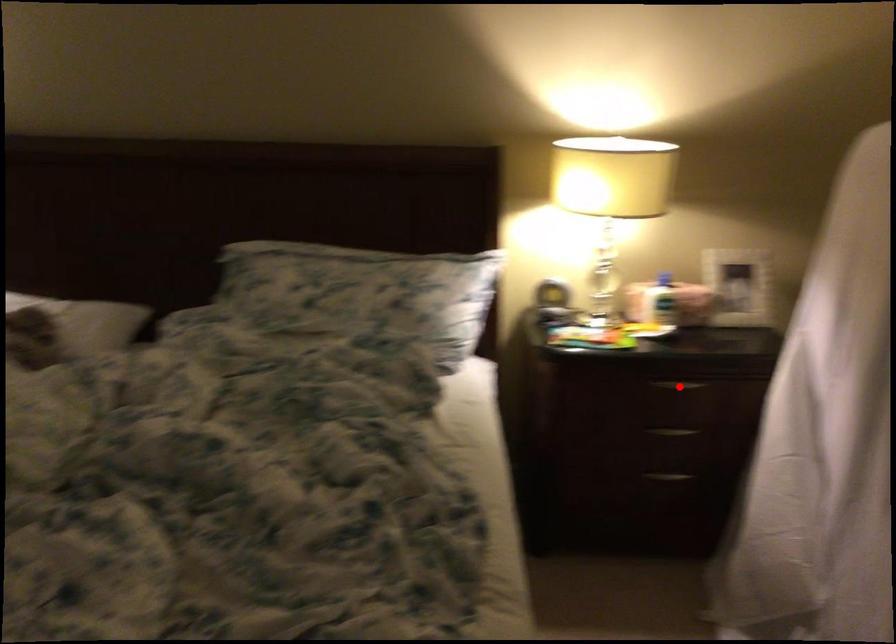
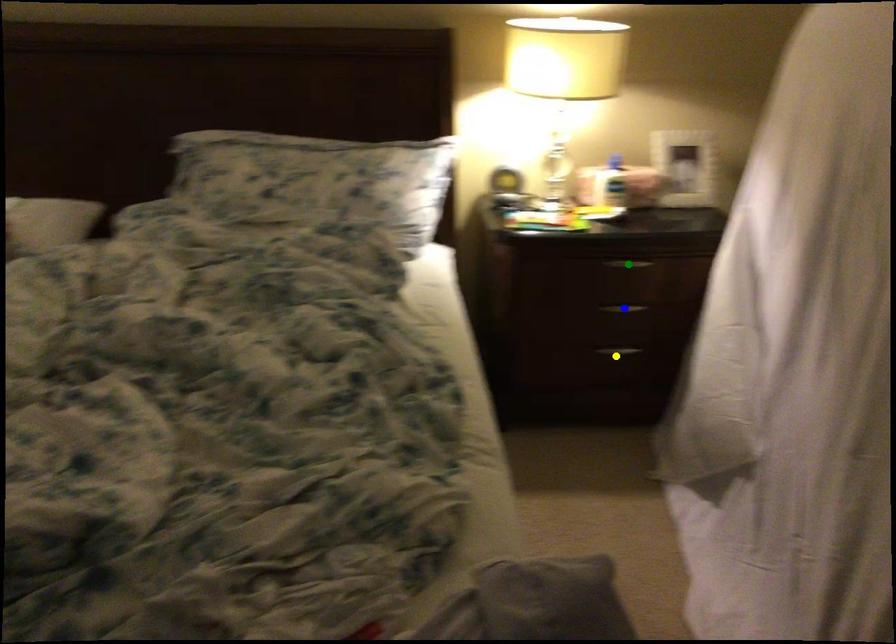
Question: I am providing you with two images of the same scene from different viewpoints. A red point is marked on the first image. You are given multiple points on the second image. Can you choose the point in image 2 that corresponds to the point in image 1?

Choices:
 (A) green point
 (B) yellow point
 (C) blue point

Answer: (A)